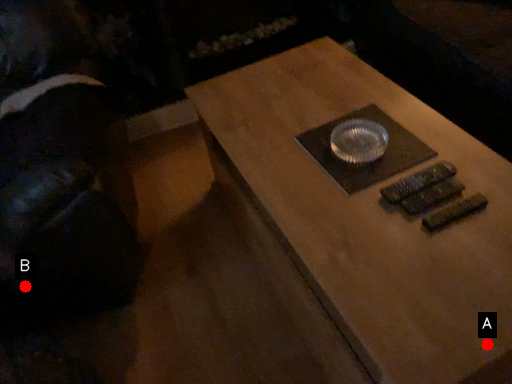
Question: Two points are circled on the image, labeled by A and B beside each circle. Which point is farther to the camera?

Choices:
 (A) A is further
 (B) B is further

Answer: (B)